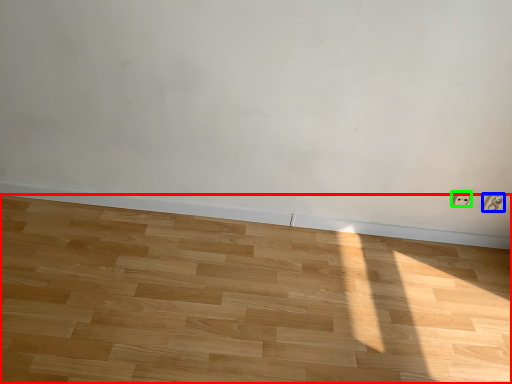
Question: Which object is the farthest from hardwood (highlighted by a red box)? Choose among these: electric outlet (highlighted by a blue box) or electric outlet (highlighted by a green box).

Choices:
 (A) electric outlet
 (B) electric outlet

Answer: (A)